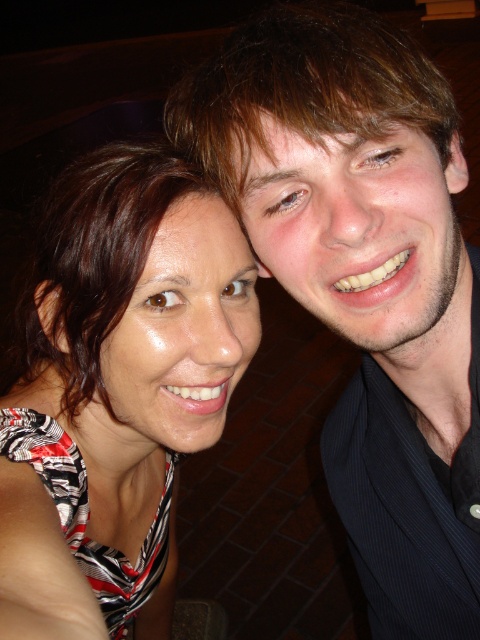
Can you confirm if black pinstripe suit at right is positioned to the right of matte black dress at left?

Yes, black pinstripe suit at right is to the right of matte black dress at left.

Image resolution: width=480 pixels, height=640 pixels. Describe the element at coordinates (364, 280) in the screenshot. I see `black pinstripe suit at right` at that location.

In order to click on black pinstripe suit at right in this screenshot , I will do `click(364, 280)`.